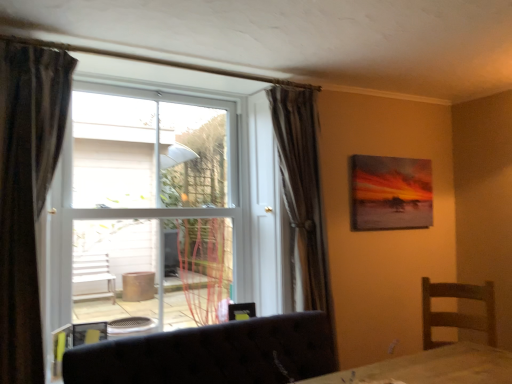
This screenshot has height=384, width=512. Describe the element at coordinates (390, 193) in the screenshot. I see `matte canvas painting at upper right` at that location.

What is the approximate width of silky brown curtain at center, the first curtain positioned from the right?

7.53 inches.

Measure the distance between dark fabric curtain at left, which ranks as the second curtain in right-to-left order, and camera.

They are 5.71 feet apart.

At what (x,y) coordinates should I click in order to perform the action: click on white plastic window at center. Please return your answer as a coordinate pair (x, y). The width and height of the screenshot is (512, 384). Looking at the image, I should click on (139, 196).

Locate an element on the screen. The width and height of the screenshot is (512, 384). dark fabric couch at lower center is located at coordinates (212, 354).

What is the approximate height of dark fabric couch at lower center?

dark fabric couch at lower center is 47.68 centimeters in height.

The width and height of the screenshot is (512, 384). Find the location of `matte canvas painting at upper right`. matte canvas painting at upper right is located at coordinates (390, 193).

Based on the photo, does matte canvas painting at upper right turn towards silky brown curtain at center, the first curtain positioned from the right?

No, matte canvas painting at upper right is not oriented towards silky brown curtain at center, the first curtain positioned from the right.

Which object is positioned more to the right, matte canvas painting at upper right or silky brown curtain at center, which is counted as the 2th curtain, starting from the front?

Positioned to the right is matte canvas painting at upper right.

Which is more distant, (415, 195) or (309, 115)?

The point (415, 195) is farther from the camera.

From the image's perspective, is dark fabric curtain at left, the second curtain from the back, positioned above or below matte canvas painting at upper right?

dark fabric curtain at left, the second curtain from the back, is situated lower than matte canvas painting at upper right in the image.

Do you think dark fabric curtain at left, the first curtain from the front, is within matte canvas painting at upper right, or outside of it?

dark fabric curtain at left, the first curtain from the front, is spatially situated outside matte canvas painting at upper right.

Is dark fabric curtain at left, which ranks as the first curtain in left-to-right order, looking in the opposite direction of matte canvas painting at upper right?

No, dark fabric curtain at left, which ranks as the first curtain in left-to-right order, is not facing the opposite direction of matte canvas painting at upper right.

Would you say dark fabric curtain at left, which ranks as the first curtain in left-to-right order, is outside dark fabric couch at lower center?

Yes, dark fabric curtain at left, which ranks as the first curtain in left-to-right order, is outside of dark fabric couch at lower center.

Measure the distance between dark fabric curtain at left, which ranks as the first curtain in left-to-right order, and dark fabric couch at lower center.

The distance of dark fabric curtain at left, which ranks as the first curtain in left-to-right order, from dark fabric couch at lower center is 32.00 inches.

Consider the image. From the image's perspective, is dark fabric curtain at left, which ranks as the first curtain in left-to-right order, positioned above or below dark fabric couch at lower center?

From the image's perspective, dark fabric curtain at left, which ranks as the first curtain in left-to-right order, appears above dark fabric couch at lower center.

Can you confirm if dark fabric curtain at left, which ranks as the second curtain in right-to-left order, is shorter than dark fabric couch at lower center?

No, dark fabric curtain at left, which ranks as the second curtain in right-to-left order, is not shorter than dark fabric couch at lower center.

Is point (232, 161) positioned after point (132, 355)?

That is True.

Which object is closer to the camera taking this photo, white plastic window at center or dark fabric couch at lower center?

dark fabric couch at lower center is closer to the camera.

The height and width of the screenshot is (384, 512). In order to click on window on the left side of dark fabric couch at lower center in this screenshot , I will do `click(139, 196)`.

Does white plastic window at center have a greater height compared to dark fabric couch at lower center?

Yes, white plastic window at center is taller than dark fabric couch at lower center.

Is dark fabric couch at lower center oriented towards dark fabric curtain at left, which ranks as the second curtain in right-to-left order?

No, dark fabric couch at lower center is not facing towards dark fabric curtain at left, which ranks as the second curtain in right-to-left order.

Is point (272, 367) behind point (36, 94)?

That is True.

Based on their positions, is dark fabric couch at lower center located to the left or right of dark fabric curtain at left, which ranks as the first curtain in left-to-right order?

dark fabric couch at lower center is to the right of dark fabric curtain at left, which ranks as the first curtain in left-to-right order.

From the image's perspective, which object appears higher, dark fabric couch at lower center or dark fabric curtain at left, which ranks as the first curtain in left-to-right order?

From the image's view, dark fabric curtain at left, which ranks as the first curtain in left-to-right order, is above.

Can you confirm if dark fabric curtain at left, the first curtain from the front, is shorter than silky brown curtain at center, which is the first curtain from back to front?

Yes.

Looking at this image, is dark fabric curtain at left, which ranks as the first curtain in left-to-right order, oriented away from silky brown curtain at center, which is counted as the 2th curtain, starting from the front?

No, silky brown curtain at center, which is counted as the 2th curtain, starting from the front, is not at the back of dark fabric curtain at left, which ranks as the first curtain in left-to-right order.

Looking at this image, considering the relative sizes of dark fabric curtain at left, the second curtain from the back, and silky brown curtain at center, which is the first curtain from back to front, in the image provided, is dark fabric curtain at left, the second curtain from the back, bigger than silky brown curtain at center, which is the first curtain from back to front,?

Incorrect, dark fabric curtain at left, the second curtain from the back, is not larger than silky brown curtain at center, which is the first curtain from back to front.

Which object is positioned more to the right, dark fabric curtain at left, the second curtain from the back, or silky brown curtain at center, which is counted as the 2th curtain, starting from the front?

Positioned to the right is silky brown curtain at center, which is counted as the 2th curtain, starting from the front.

Locate an element on the screen. The image size is (512, 384). picture frame that appears above the white plastic window at center (from the image's perspective) is located at coordinates (390, 193).

Considering the sizes of objects matte canvas painting at upper right and white plastic window at center in the image provided, who is shorter, matte canvas painting at upper right or white plastic window at center?

matte canvas painting at upper right is shorter.

Considering the relative positions of matte canvas painting at upper right and white plastic window at center in the image provided, is matte canvas painting at upper right to the right of white plastic window at center from the viewer's perspective?

Yes, matte canvas painting at upper right is to the right of white plastic window at center.

Would you say matte canvas painting at upper right is a long distance from white plastic window at center?

Yes, matte canvas painting at upper right and white plastic window at center are located far from each other.

Image resolution: width=512 pixels, height=384 pixels. Identify the location of picture frame to the right of silky brown curtain at center, which is the 2th curtain in left-to-right order. (390, 193).

Where is `curtain that is the 1st object directly below the matte canvas painting at upper right (from a real-world perspective)`? Image resolution: width=512 pixels, height=384 pixels. curtain that is the 1st object directly below the matte canvas painting at upper right (from a real-world perspective) is located at coordinates (26, 192).

When comparing their distances from matte canvas painting at upper right, does dark fabric curtain at left, the second curtain from the back, or silky brown curtain at center, which is the first curtain from back to front, seem closer?

silky brown curtain at center, which is the first curtain from back to front, is positioned closer to the anchor matte canvas painting at upper right.

Based on their spatial positions, is matte canvas painting at upper right or white plastic window at center further from dark fabric couch at lower center?

matte canvas painting at upper right is further to dark fabric couch at lower center.

Based on their spatial positions, is silky brown curtain at center, the first curtain positioned from the right, or dark fabric couch at lower center closer to dark fabric curtain at left, which ranks as the first curtain in left-to-right order?

Based on the image, dark fabric couch at lower center appears to be nearer to dark fabric curtain at left, which ranks as the first curtain in left-to-right order.

From the picture: Based on their spatial positions, is dark fabric curtain at left, which ranks as the second curtain in right-to-left order, or matte canvas painting at upper right closer to silky brown curtain at center, which is the 2th curtain in left-to-right order?

The object closer to silky brown curtain at center, which is the 2th curtain in left-to-right order, is matte canvas painting at upper right.

Estimate the real-world distances between objects in this image. Which object is further from dark fabric couch at lower center, silky brown curtain at center, which is the 2th curtain in left-to-right order, or matte canvas painting at upper right?

matte canvas painting at upper right.

Estimate the real-world distances between objects in this image. Which object is closer to silky brown curtain at center, which is the first curtain from back to front, dark fabric curtain at left, which ranks as the second curtain in right-to-left order, or white plastic window at center?

white plastic window at center is closer to silky brown curtain at center, which is the first curtain from back to front.

Considering their positions, is silky brown curtain at center, which is the 2th curtain in left-to-right order, positioned further to matte canvas painting at upper right than white plastic window at center?

Based on the image, white plastic window at center appears to be further to matte canvas painting at upper right.

Which object lies further to the anchor point white plastic window at center, silky brown curtain at center, which is the first curtain from back to front, or dark fabric curtain at left, which ranks as the second curtain in right-to-left order?

Among the two, dark fabric curtain at left, which ranks as the second curtain in right-to-left order, is located further to white plastic window at center.

This screenshot has height=384, width=512. In order to click on furniture situated between dark fabric curtain at left, the first curtain from the front, and silky brown curtain at center, which is the 2th curtain in left-to-right order, from left to right in this screenshot , I will do `click(212, 354)`.

Find the location of a particular element. Image resolution: width=512 pixels, height=384 pixels. curtain between dark fabric curtain at left, the first curtain from the front, and matte canvas painting at upper right is located at coordinates (302, 198).

What are the coordinates of `window between dark fabric curtain at left, which ranks as the first curtain in left-to-right order, and dark fabric couch at lower center` in the screenshot? It's located at (139, 196).

This screenshot has width=512, height=384. Identify the location of furniture between dark fabric curtain at left, the second curtain from the back, and matte canvas painting at upper right from left to right. (212, 354).